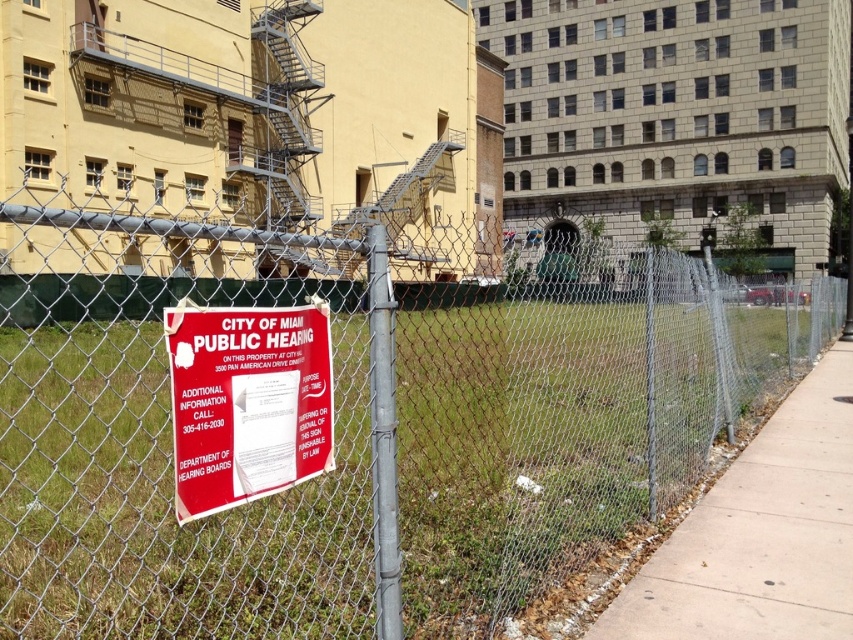
Question: Does concrete sidewalk at lower right have a larger size compared to red paper sign at center?

Choices:
 (A) yes
 (B) no

Answer: (A)

Question: Does rusty chain-link fence at center appear on the left side of concrete sidewalk at lower right?

Choices:
 (A) yes
 (B) no

Answer: (B)

Question: Which is nearer to the rusty chain-link fence at center?

Choices:
 (A) concrete sidewalk at lower right
 (B) red paper sign at center

Answer: (A)

Question: From the image, what is the correct spatial relationship of concrete sidewalk at lower right in relation to red paper sign at center?

Choices:
 (A) right
 (B) left

Answer: (A)

Question: Which point is closer to the camera?

Choices:
 (A) red paper sign at center
 (B) rusty chain-link fence at center
 (C) concrete sidewalk at lower right

Answer: (A)

Question: Which point appears closest to the camera in this image?

Choices:
 (A) (20, 337)
 (B) (254, 355)
 (C) (772, 609)

Answer: (B)